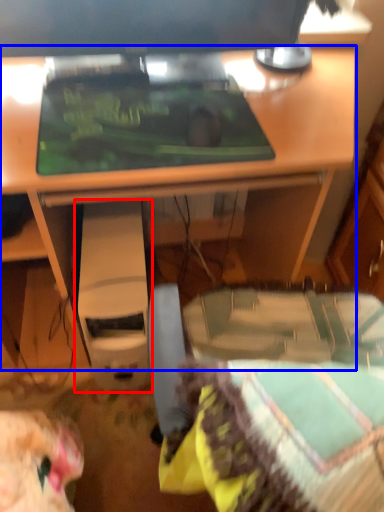
Question: Which point is further to the camera, computer (highlighted by a red box) or desk (highlighted by a blue box)?

Choices:
 (A) computer
 (B) desk

Answer: (A)